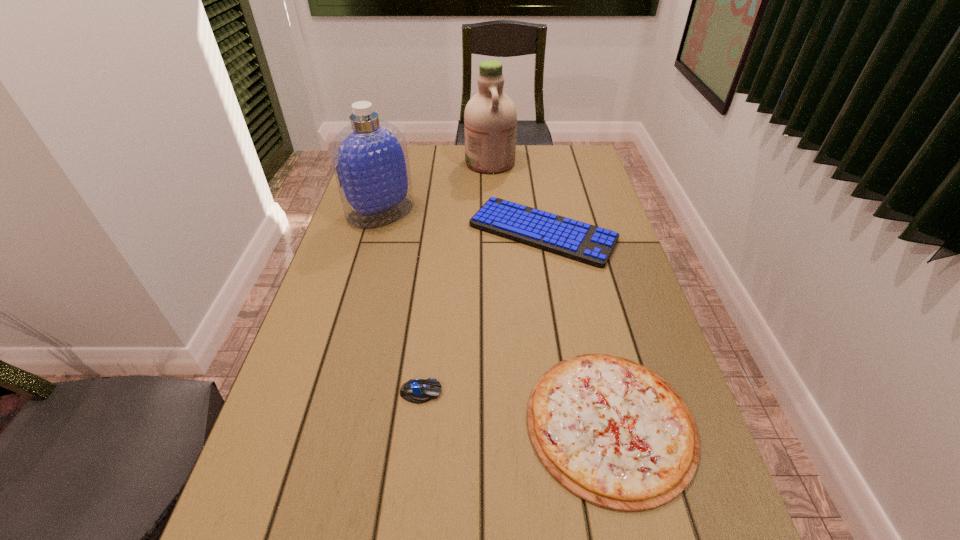
At what (x,y) coordinates should I click in order to perform the action: click on the farthest object. Please return your answer as a coordinate pair (x, y). The height and width of the screenshot is (540, 960). Looking at the image, I should click on (490, 118).

At what (x,y) coordinates should I click in order to perform the action: click on the right cleansing agent. Please return your answer as a coordinate pair (x, y). The height and width of the screenshot is (540, 960). Looking at the image, I should click on (490, 118).

At what (x,y) coordinates should I click in order to perform the action: click on the left cleansing agent. Please return your answer as a coordinate pair (x, y). This screenshot has height=540, width=960. Looking at the image, I should click on (370, 160).

Find the location of `the nearer cleansing agent`. the nearer cleansing agent is located at coordinates (370, 160).

You are a GUI agent. You are given a task and a screenshot of the screen. Output one action in this format:
    pyautogui.click(x=<x>, y=<y>)
    Task: Click on the computer keyboard
    This screenshot has height=540, width=960.
    Given the screenshot: What is the action you would take?
    [x=579, y=241]

The width and height of the screenshot is (960, 540). I want to click on the fourth object from right to left, so click(x=418, y=391).

You are a GUI agent. You are given a task and a screenshot of the screen. Output one action in this format:
    pyautogui.click(x=<x>, y=<y>)
    Task: Click on the shortest object
    
    Given the screenshot: What is the action you would take?
    pyautogui.click(x=614, y=433)

At what (x,y) coordinates should I click in order to perform the action: click on vacant position located 0.050m on the front label of the farther cleansing agent. Please return your answer as a coordinate pair (x, y). This screenshot has width=960, height=540. Looking at the image, I should click on (452, 162).

This screenshot has height=540, width=960. Identify the location of vacant position located on the front label of the farther cleansing agent. (384, 162).

Where is `vacant region located 0.180m on the front label of the farther cleansing agent`? The width and height of the screenshot is (960, 540). vacant region located 0.180m on the front label of the farther cleansing agent is located at coordinates (417, 162).